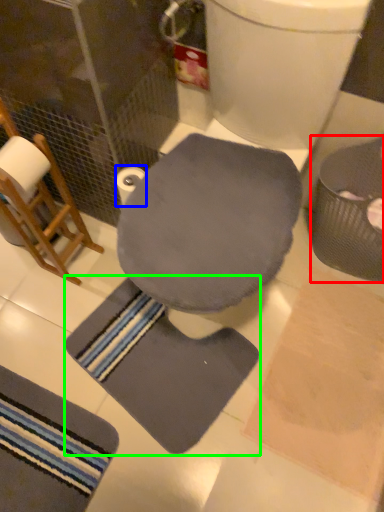
Question: Considering the real-world distances, which object is closest to potty (highlighted by a red box)? toilet paper (highlighted by a blue box) or bath mat (highlighted by a green box).

Choices:
 (A) toilet paper
 (B) bath mat

Answer: (B)